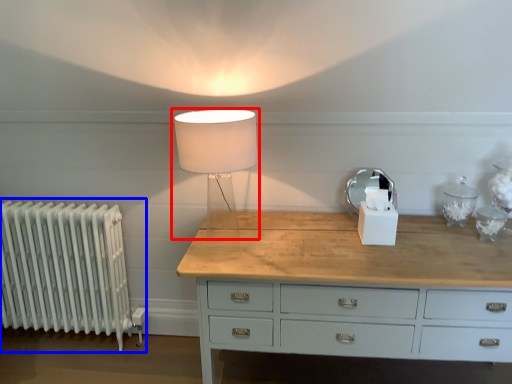
Question: Among these objects, which one is nearest to the camera, lamp (highlighted by a red box) or radiator (highlighted by a blue box)?

Choices:
 (A) lamp
 (B) radiator

Answer: (A)